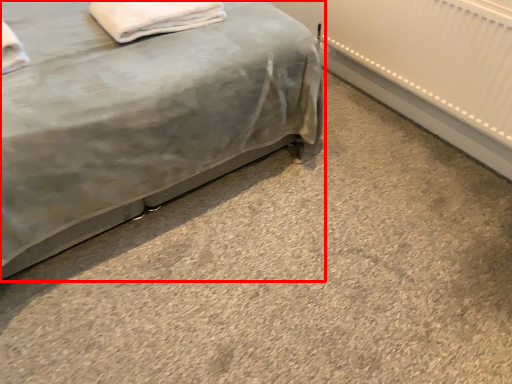
Question: From the image's perspective, what is the correct spatial relationship of bed (annotated by the red box) in relation to material?

Choices:
 (A) above
 (B) below

Answer: (A)